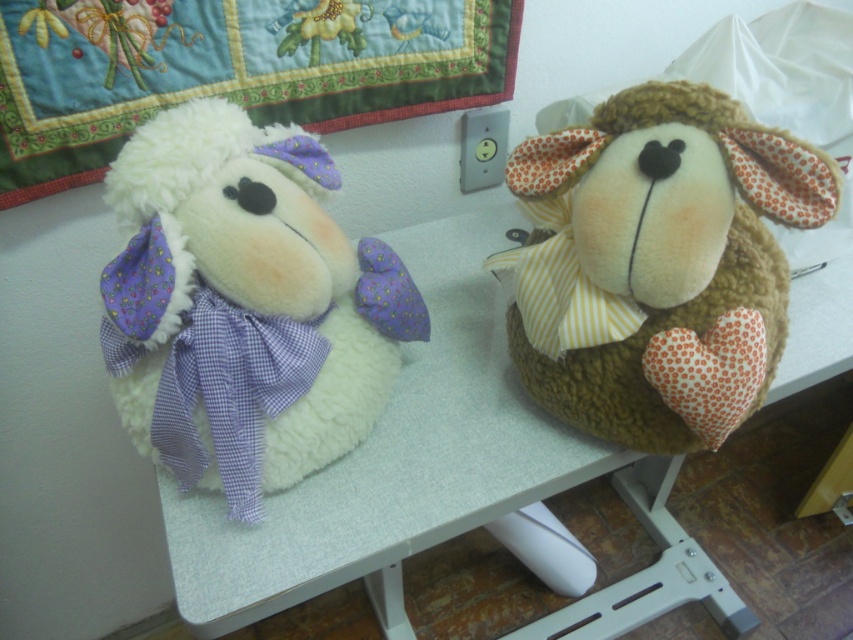
Between white fluffy sheep at left and embroidered cotton quilt at upper left, which one is positioned lower?

white fluffy sheep at left is below.

Is point (357, 376) farther from camera compared to point (463, 92)?

No.

You are a GUI agent. You are given a task and a screenshot of the screen. Output one action in this format:
    pyautogui.click(x=<x>, y=<y>)
    Task: Click on the white fluffy sheep at left
    Image resolution: width=853 pixels, height=640 pixels.
    Given the screenshot: What is the action you would take?
    pyautogui.click(x=244, y=305)

Can you confirm if white fluffy sheep at left is positioned to the right of brown fuzzy stuffed animal at right?

No, white fluffy sheep at left is not to the right of brown fuzzy stuffed animal at right.

Is point (288, 262) in front of point (631, 195)?

Yes.

Is point (262, 369) positioned after point (556, 140)?

No, it is in front of (556, 140).

The image size is (853, 640). In order to click on white fluffy sheep at left in this screenshot , I will do `click(244, 305)`.

Does white textured table at center have a larger size compared to brown fuzzy stuffed animal at right?

Correct, white textured table at center is larger in size than brown fuzzy stuffed animal at right.

Can you confirm if white textured table at center is positioned above brown fuzzy stuffed animal at right?

No, white textured table at center is not above brown fuzzy stuffed animal at right.

Is point (463, 458) positioned after point (724, 401)?

Yes, point (463, 458) is farther from viewer.

At what (x,y) coordinates should I click in order to perform the action: click on white textured table at center. Please return your answer as a coordinate pair (x, y). The height and width of the screenshot is (640, 853). Looking at the image, I should click on (393, 458).